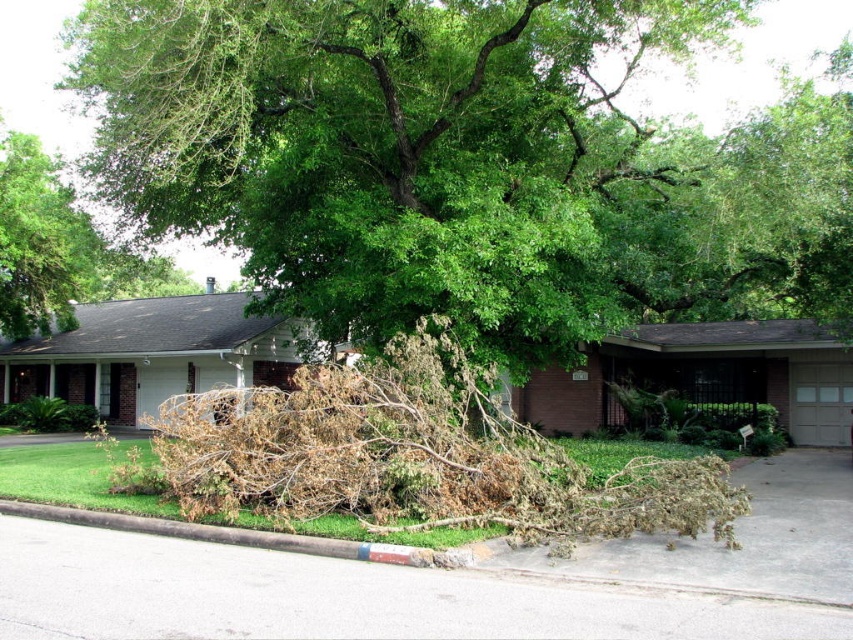
Question: Which of the following is the closest to the observer?

Choices:
 (A) green leafy tree at upper left
 (B) brown/dried wood at center

Answer: (B)

Question: Among these points, which one is farthest from the camera?

Choices:
 (A) (364, 189)
 (B) (345, 440)

Answer: (A)

Question: Which point is closer to the camera?

Choices:
 (A) brown/dried wood at center
 (B) brown concrete curb at lower center
 (C) brown dry branches at center
 (D) green leafy tree at upper left

Answer: (B)

Question: Does brown dry branches at center lie in front of green leafy tree at upper left?

Choices:
 (A) no
 (B) yes

Answer: (B)

Question: Can you confirm if brown/dried wood at center is positioned below brown dry branches at center?

Choices:
 (A) no
 (B) yes

Answer: (A)

Question: Is brown/dried wood at center below green leafy tree at upper left?

Choices:
 (A) no
 (B) yes

Answer: (A)